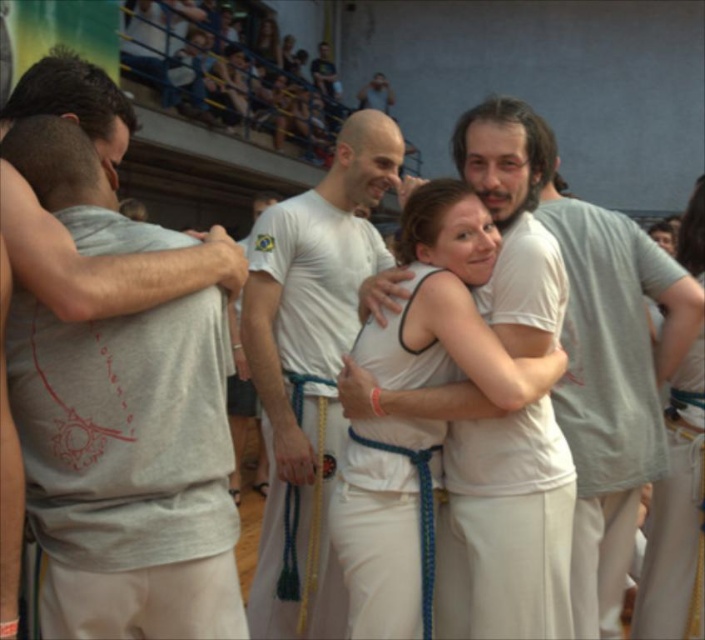
Which is behind, point (400, 572) or point (678, 490)?

The point (678, 490) is more distant.

Does white cotton robe at center have a lesser width compared to white cotton tank top at center?

Incorrect, white cotton robe at center's width is not less than white cotton tank top at center's.

The height and width of the screenshot is (640, 705). I want to click on white cotton robe at center, so click(386, 522).

The image size is (705, 640). Identify the location of white cotton robe at center. (386, 522).

Between gray cotton t-shirt at right and gray matte t-shirt at left, which one has less height?

With less height is gray matte t-shirt at left.

Is point (558, 193) farther from viewer compared to point (73, 54)?

Yes, it is behind point (73, 54).

Between point (618, 612) and point (20, 225), which one is positioned behind?

The point (618, 612) is more distant.

Identify the location of gray cotton t-shirt at right. (611, 381).

How distant is white cotton shirt at center from white fabric at center?

They are 4.09 feet apart.

Does point (278, 289) come closer to viewer compared to point (453, 186)?

No, it is not.

You are a GUI agent. You are given a task and a screenshot of the screen. Output one action in this format:
    pyautogui.click(x=<x>, y=<y>)
    Task: Click on the white cotton shirt at center
    The width and height of the screenshot is (705, 640).
    Given the screenshot: What is the action you would take?
    pyautogui.click(x=309, y=365)